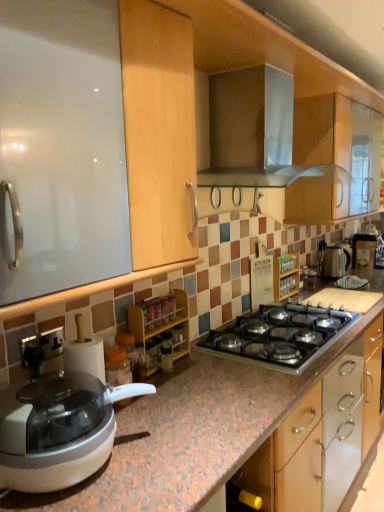
This screenshot has width=384, height=512. What are the coordinates of `metallic silver range hood at upper center, placed as the first kitchen appliance when sorted from left to right` in the screenshot? It's located at (252, 130).

What do you see at coordinates (161, 331) in the screenshot? The image size is (384, 512). I see `wooden spice rack at center, the 1th cabinetry in the left-to-right sequence` at bounding box center [161, 331].

Identify the location of wooden spice rack at center, which is the 1th cabinetry from front to back. The image size is (384, 512). (161, 331).

The width and height of the screenshot is (384, 512). What do you see at coordinates (58, 430) in the screenshot? I see `white plastic food processor at lower left` at bounding box center [58, 430].

Measure the distance between white plastic food processor at lower left and camera.

A distance of 93.30 centimeters exists between white plastic food processor at lower left and camera.

Identify the location of satin silver kettle at right, arranged as the 1th kitchen appliance when ordered from the bottom. (335, 262).

This screenshot has width=384, height=512. What are the coordinates of `metallic silver range hood at upper center, placed as the 1th kitchen appliance when sorted from front to back` in the screenshot? It's located at (252, 130).

From a real-world perspective, who is located higher, metallic silver gas stove at center or wooden spice rack at center, the second cabinetry viewed from the front?

wooden spice rack at center, the second cabinetry viewed from the front.

Based on the photo, can you confirm if metallic silver gas stove at center is positioned to the right of wooden spice rack at center, positioned as the second cabinetry in left-to-right order?

In fact, metallic silver gas stove at center is to the left of wooden spice rack at center, positioned as the second cabinetry in left-to-right order.

Is metallic silver gas stove at center inside or outside of wooden spice rack at center, positioned as the second cabinetry in left-to-right order?

metallic silver gas stove at center is outside wooden spice rack at center, positioned as the second cabinetry in left-to-right order.

Which point is more forward, (x=336, y=332) or (x=286, y=257)?

The point (x=336, y=332) is more forward.

In the scene shown: Is wooden spice rack at center, the 1th cabinetry in the left-to-right sequence, not inside translucent plastic container at center?

Yes, wooden spice rack at center, the 1th cabinetry in the left-to-right sequence, is located beyond the bounds of translucent plastic container at center.

From a real-world perspective, is wooden spice rack at center, the 1th cabinetry in the left-to-right sequence, positioned above or below translucent plastic container at center?

From a real-world perspective, wooden spice rack at center, the 1th cabinetry in the left-to-right sequence, is physically above translucent plastic container at center.

Relative to translucent plastic container at center, is wooden spice rack at center, acting as the second cabinetry starting from the right, in front or behind?

Visually, wooden spice rack at center, acting as the second cabinetry starting from the right, is located behind translucent plastic container at center.

From their relative heights in the image, would you say wooden spice rack at center, acting as the second cabinetry starting from the right, is taller or shorter than translucent plastic container at center?

Clearly, wooden spice rack at center, acting as the second cabinetry starting from the right, is taller compared to translucent plastic container at center.

Is white plastic food processor at lower left taller or shorter than wooden spice rack at center, marked as the first cabinetry in a right-to-left arrangement?

Considering their sizes, white plastic food processor at lower left has less height than wooden spice rack at center, marked as the first cabinetry in a right-to-left arrangement.

From a real-world perspective, is white plastic food processor at lower left positioned above or below wooden spice rack at center, acting as the 1th cabinetry starting from the back?

Clearly, from a real-world perspective, white plastic food processor at lower left is below wooden spice rack at center, acting as the 1th cabinetry starting from the back.

This screenshot has height=512, width=384. Identify the location of the 2nd cabinetry directly above the white plastic food processor at lower left (from a real-world perspective). (286, 276).

Looking at this image, does white plastic food processor at lower left turn towards wooden spice rack at center, marked as the first cabinetry in a right-to-left arrangement?

No, white plastic food processor at lower left is not aimed at wooden spice rack at center, marked as the first cabinetry in a right-to-left arrangement.

Does point (227, 166) appear closer or farther from the camera than point (87, 465)?

Point (227, 166) appears to be farther away from the viewer than point (87, 465).

How distant is metallic silver range hood at upper center, placed as the 2th kitchen appliance when sorted from bottom to top, from white plastic food processor at lower left?

metallic silver range hood at upper center, placed as the 2th kitchen appliance when sorted from bottom to top, is 1.08 meters away from white plastic food processor at lower left.

Between metallic silver range hood at upper center, which ranks as the first kitchen appliance in top-to-bottom order, and white plastic food processor at lower left, which one has less height?

Standing shorter between the two is white plastic food processor at lower left.

The height and width of the screenshot is (512, 384). I want to click on home appliance on the left of metallic silver range hood at upper center, placed as the 2th kitchen appliance when sorted from back to front, so click(58, 430).

From the image's perspective, between white plastic food processor at lower left and metallic silver coffee machine at right, who is located below?

From the image's view, white plastic food processor at lower left is below.

Can we say white plastic food processor at lower left lies outside metallic silver coffee machine at right?

That's correct, white plastic food processor at lower left is outside of metallic silver coffee machine at right.

You are a GUI agent. You are given a task and a screenshot of the screen. Output one action in this format:
    pyautogui.click(x=<x>, y=<y>)
    Task: Click on the home appliance below the metallic silver coffee machine at right (from a real-world perspective)
    The height and width of the screenshot is (512, 384).
    Given the screenshot: What is the action you would take?
    pyautogui.click(x=58, y=430)

From the image's perspective, is wooden spice rack at center, marked as the first cabinetry in a right-to-left arrangement, under satin silver kettle at right, the second kitchen appliance viewed from the left?

Yes, from the image's perspective, wooden spice rack at center, marked as the first cabinetry in a right-to-left arrangement, is beneath satin silver kettle at right, the second kitchen appliance viewed from the left.

From a real-world perspective, is wooden spice rack at center, acting as the 1th cabinetry starting from the back, located higher than satin silver kettle at right, acting as the first kitchen appliance starting from the back?

Yes.

Can you confirm if wooden spice rack at center, marked as the first cabinetry in a right-to-left arrangement, is taller than satin silver kettle at right, acting as the first kitchen appliance starting from the back?

Yes.

Is wooden spice rack at center, positioned as the second cabinetry in left-to-right order, spatially inside satin silver kettle at right, which appears as the 2th kitchen appliance when viewed from the top, or outside of it?

The correct answer is: outside.

Is metallic silver gas stove at center at the back of white plastic food processor at lower left?

white plastic food processor at lower left does not have its back to metallic silver gas stove at center.

Is white plastic food processor at lower left bigger than metallic silver gas stove at center?

Correct, white plastic food processor at lower left is larger in size than metallic silver gas stove at center.

Find the location of a particular element. home appliance located above the metallic silver gas stove at center (from a real-world perspective) is located at coordinates (58, 430).

Locate an element on the screen. This screenshot has width=384, height=512. cabinetry that is the 2nd object above the metallic silver gas stove at center (from a real-world perspective) is located at coordinates (286, 276).

Where is `the 1st cabinetry above the translucent plastic container at center (from the image's perspective)`? The image size is (384, 512). the 1st cabinetry above the translucent plastic container at center (from the image's perspective) is located at coordinates (161, 331).

From the picture: Estimate the real-world distances between objects in this image. Which object is further from wooden spice rack at center, positioned as the second cabinetry in left-to-right order, wooden spice rack at center, which is the 1th cabinetry from front to back, or metallic silver coffee machine at right?

metallic silver coffee machine at right is further to wooden spice rack at center, positioned as the second cabinetry in left-to-right order.

Based on the photo, when comparing their distances from metallic silver range hood at upper center, placed as the 2th kitchen appliance when sorted from bottom to top, does satin silver kettle at right, acting as the first kitchen appliance starting from the back, or metallic silver coffee machine at right seem further?

metallic silver coffee machine at right.

In the scene shown: From the image, which object appears to be farther from satin silver kettle at right, which appears as the 2th kitchen appliance when viewed from the top, translucent plastic container at center or metallic silver coffee machine at right?

translucent plastic container at center lies further to satin silver kettle at right, which appears as the 2th kitchen appliance when viewed from the top, than the other object.

From the image, which object appears to be nearer to wooden spice rack at center, the second cabinetry viewed from the front, white plastic food processor at lower left or metallic silver range hood at upper center, placed as the 2th kitchen appliance when sorted from back to front?

metallic silver range hood at upper center, placed as the 2th kitchen appliance when sorted from back to front, is positioned closer to the anchor wooden spice rack at center, the second cabinetry viewed from the front.

Based on their spatial positions, is metallic silver coffee machine at right or wooden spice rack at center, which is the 1th cabinetry from front to back, further from white plastic food processor at lower left?

Among the two, metallic silver coffee machine at right is located further to white plastic food processor at lower left.

Looking at the image, which one is located closer to satin silver kettle at right, acting as the first kitchen appliance starting from the back, wooden spice rack at center, acting as the 1th cabinetry starting from the back, or metallic silver coffee machine at right?

metallic silver coffee machine at right is positioned closer to the anchor satin silver kettle at right, acting as the first kitchen appliance starting from the back.

Based on the photo, considering their positions, is metallic silver range hood at upper center, which is the second kitchen appliance in right-to-left order, positioned further to translucent plastic container at center than wooden spice rack at center, the 1th cabinetry in the left-to-right sequence?

Among the two, metallic silver range hood at upper center, which is the second kitchen appliance in right-to-left order, is located further to translucent plastic container at center.

Estimate the real-world distances between objects in this image. Which object is further from white plastic food processor at lower left, wooden spice rack at center, acting as the 1th cabinetry starting from the back, or metallic silver gas stove at center?

wooden spice rack at center, acting as the 1th cabinetry starting from the back.

Find the location of a particular element. kitchen appliance between white plastic food processor at lower left and satin silver kettle at right, marked as the first kitchen appliance in a right-to-left arrangement, in the front-back direction is located at coordinates (252, 130).

Where is `cabinetry between white plastic food processor at lower left and wooden spice rack at center, acting as the 1th cabinetry starting from the back, in the front-back direction`? The height and width of the screenshot is (512, 384). cabinetry between white plastic food processor at lower left and wooden spice rack at center, acting as the 1th cabinetry starting from the back, in the front-back direction is located at coordinates (161, 331).

Locate an element on the screen. The width and height of the screenshot is (384, 512). gas stove between wooden spice rack at center, the 1th cabinetry in the left-to-right sequence, and satin silver kettle at right, marked as the first kitchen appliance in a right-to-left arrangement, from front to back is located at coordinates (280, 335).

I want to click on appliance between white plastic food processor at lower left and wooden spice rack at center, which is the 1th cabinetry from front to back, in the front-back direction, so coord(117,366).